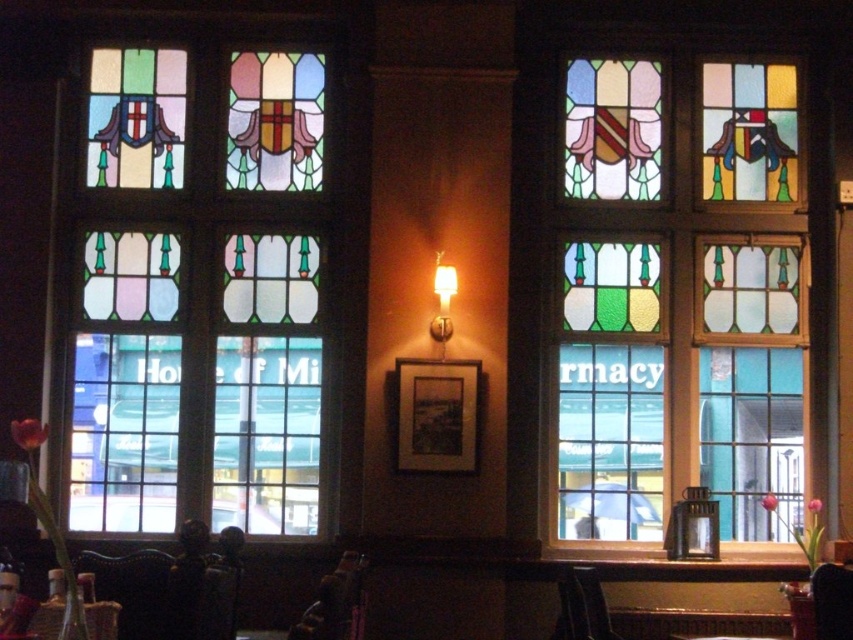
Question: Is stained glass window at left to the right of stained glass window at center from the viewer's perspective?

Choices:
 (A) yes
 (B) no

Answer: (B)

Question: Which point appears closest to the camera in this image?

Choices:
 (A) (599, 243)
 (B) (750, 90)
 (C) (573, 116)
 (D) (314, 490)

Answer: (D)

Question: Is stained glass window at center to the left of matte stained glass shield at center from the viewer's perspective?

Choices:
 (A) no
 (B) yes

Answer: (A)

Question: Which point appears closest to the camera in this image?

Choices:
 (A) (631, 397)
 (B) (213, 216)
 (C) (769, 132)

Answer: (A)

Question: Which point is farther to the camera?

Choices:
 (A) click(x=753, y=381)
 (B) click(x=724, y=172)
 (C) click(x=592, y=72)

Answer: (C)

Question: Is stained glass window at center to the right of matte stained glass shield at center from the viewer's perspective?

Choices:
 (A) no
 (B) yes

Answer: (B)